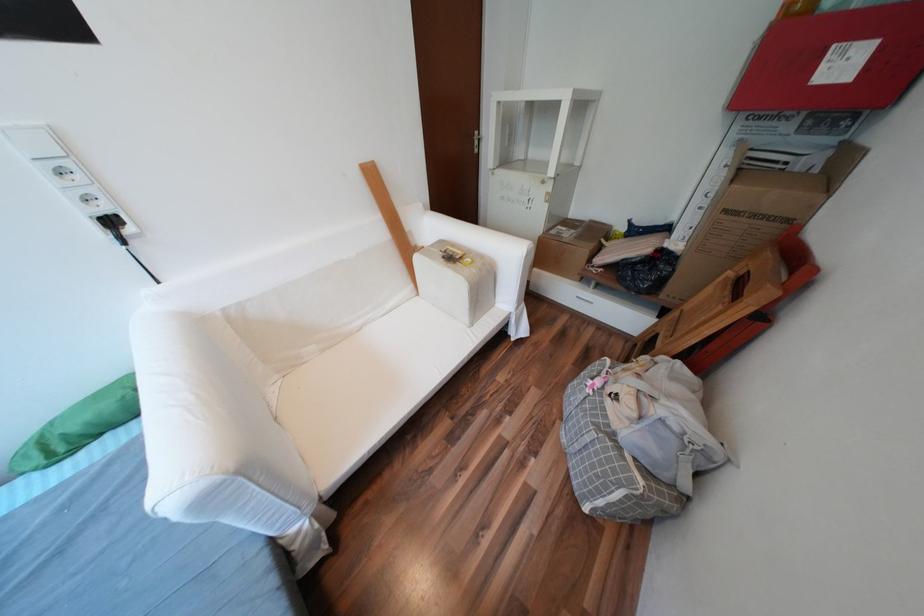
The location [113,223] corresponds to which object?

This point indicates the black electrical plug.